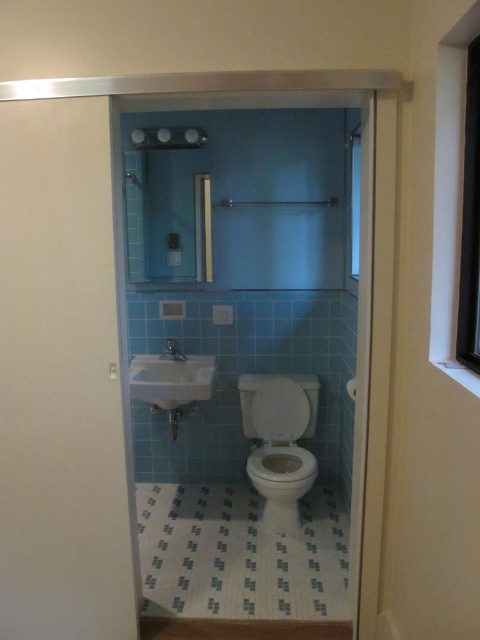
Question: Estimate the real-world distances between objects in this image. Which object is farther from the white glossy toilet at center?

Choices:
 (A) white wood window at upper right
 (B) white glossy showerhead at upper center
 (C) transparent glass window at upper right

Answer: (C)

Question: Is white wood window at upper right thinner than matte silver faucet at center?

Choices:
 (A) yes
 (B) no

Answer: (A)

Question: Where is white glossy toilet at center located in relation to white glossy sink at lower left in the image?

Choices:
 (A) above
 (B) below

Answer: (B)

Question: Does white wood window at upper right appear on the right side of matte silver faucet at center?

Choices:
 (A) yes
 (B) no

Answer: (A)

Question: Which object is positioned closest to the transparent glass window at upper right?

Choices:
 (A) matte silver faucet at center
 (B) white wood window at upper right
 (C) white glossy showerhead at upper center

Answer: (B)

Question: Which of the following is the closest to the observer?

Choices:
 (A) (131, 362)
 (B) (457, 36)
 (C) (275, 499)
 (D) (157, 145)

Answer: (B)